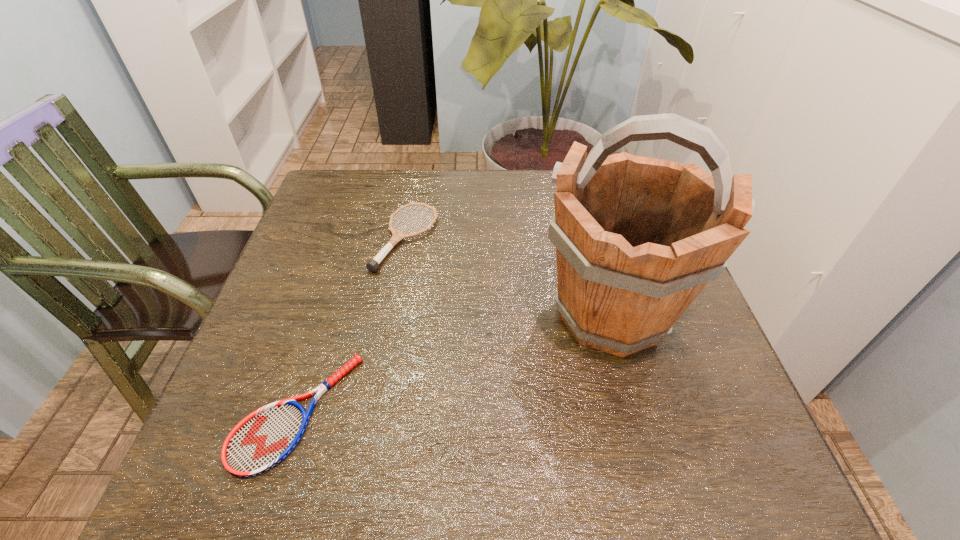
Locate an element on the screen. The image size is (960, 540). free point between the bucket and the second tallest object is located at coordinates (508, 276).

Find the location of a particular element. The width and height of the screenshot is (960, 540). vacant region between the nearer tennis racket and the rightmost object is located at coordinates (454, 363).

Where is `vacant space that's between the shorter tennis racket and the farther tennis racket`? vacant space that's between the shorter tennis racket and the farther tennis racket is located at coordinates (351, 325).

I want to click on blank region between the farther tennis racket and the nearer tennis racket, so click(351, 325).

The width and height of the screenshot is (960, 540). Find the location of `free space between the bucket and the second tallest object`. free space between the bucket and the second tallest object is located at coordinates (508, 276).

Locate an element on the screen. This screenshot has width=960, height=540. vacant region between the bucket and the farther tennis racket is located at coordinates (508, 276).

At what (x,y) coordinates should I click in order to perform the action: click on free space that is in between the second tallest object and the shortest object. Please return your answer as a coordinate pair (x, y). This screenshot has height=540, width=960. Looking at the image, I should click on (351, 325).

You are a GUI agent. You are given a task and a screenshot of the screen. Output one action in this format:
    pyautogui.click(x=<x>, y=<y>)
    Task: Click on the object that can be found as the second closest to the tallest object
    
    Given the screenshot: What is the action you would take?
    pyautogui.click(x=263, y=439)

This screenshot has width=960, height=540. Identify the location of object that stands as the second closest to the shortest object. (637, 239).

You are a GUI agent. You are given a task and a screenshot of the screen. Output one action in this format:
    pyautogui.click(x=<x>, y=<y>)
    Task: Click on the free spot that satisfies the following two spatial constraints: 1. on the front side of the bucket; 2. on the left side of the second tallest object
    This screenshot has height=540, width=960.
    Given the screenshot: What is the action you would take?
    pyautogui.click(x=392, y=314)